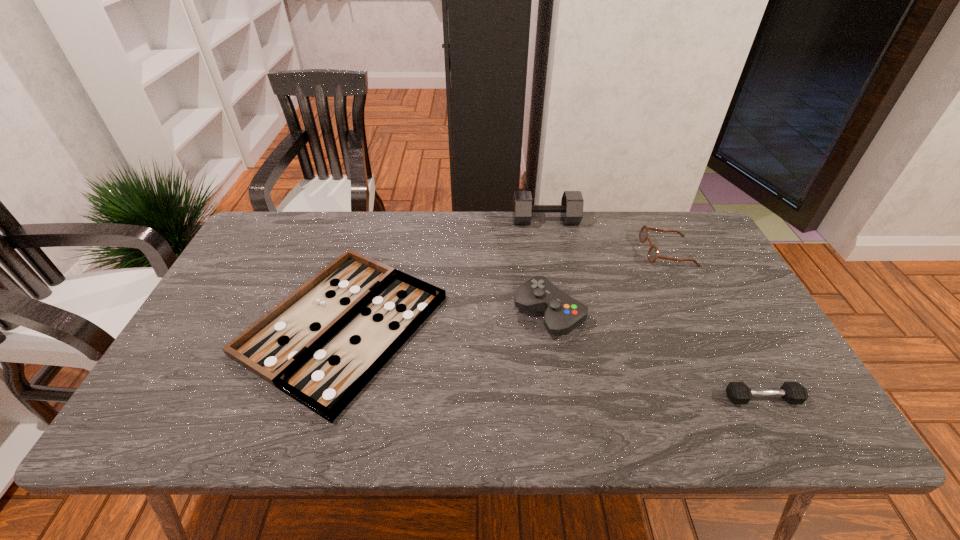
Image resolution: width=960 pixels, height=540 pixels. Find the location of `free space at the right edge`. free space at the right edge is located at coordinates (720, 297).

The width and height of the screenshot is (960, 540). Identify the location of vacant space at the far right corner of the desktop. (684, 214).

Where is `vacant area that lies between the farther dumbbell and the fourth shortest object`? Image resolution: width=960 pixels, height=540 pixels. vacant area that lies between the farther dumbbell and the fourth shortest object is located at coordinates (547, 267).

Locate an element on the screen. This screenshot has width=960, height=540. free space between the spectacles and the farthest object is located at coordinates (607, 236).

I want to click on vacant area that lies between the shorter dumbbell and the fourth shortest object, so click(x=656, y=356).

Locate an element on the screen. The image size is (960, 540). empty space that is in between the control and the shortest object is located at coordinates (446, 319).

The height and width of the screenshot is (540, 960). In order to click on vacant area that lies between the third tallest object and the nearer dumbbell in this screenshot , I will do `click(715, 325)`.

The height and width of the screenshot is (540, 960). Identify the location of free space between the gameboard and the left dumbbell. (444, 273).

Find the location of `empty space between the gameboard and the left dumbbell`. empty space between the gameboard and the left dumbbell is located at coordinates (444, 273).

You are a GUI agent. You are given a task and a screenshot of the screen. Output one action in this format:
    pyautogui.click(x=<x>, y=<y>)
    Task: Click on the vacant area between the taller dumbbell and the second shortest object
    
    Given the screenshot: What is the action you would take?
    pyautogui.click(x=654, y=309)